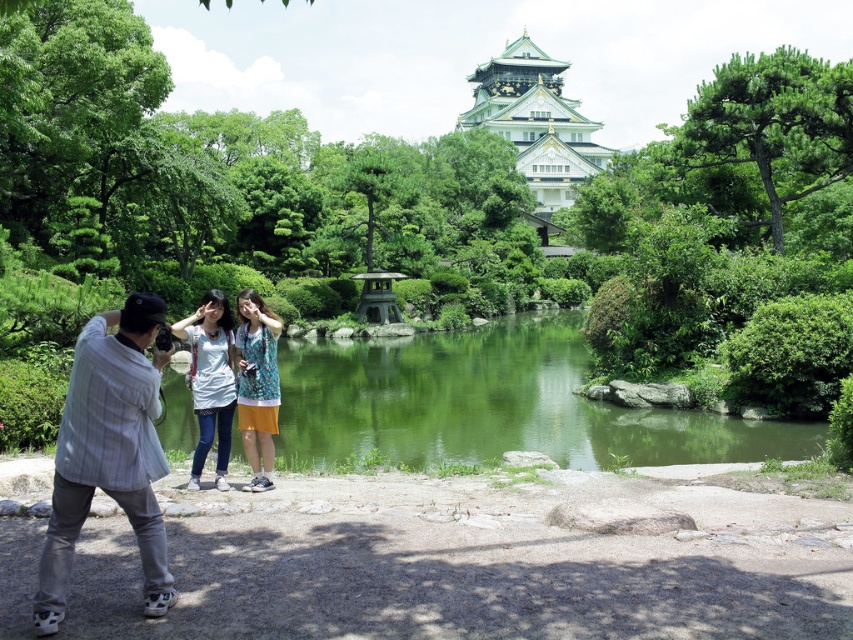
Question: Which point is closer to the camera?

Choices:
 (A) (144, 508)
 (B) (479, 104)
 (C) (213, 349)

Answer: (A)

Question: Is white cotton shirt at center thinner than printed cotton dress at center?

Choices:
 (A) no
 (B) yes

Answer: (A)

Question: Is white cotton shirt at center in front of printed cotton dress at center?

Choices:
 (A) no
 (B) yes

Answer: (B)

Question: Based on their relative distances, which object is nearer to the white cotton shirt at center?

Choices:
 (A) printed cotton dress at center
 (B) white glossy pagoda at upper center

Answer: (A)

Question: Can you confirm if gray striped shirt at left is smaller than printed cotton dress at center?

Choices:
 (A) no
 (B) yes

Answer: (A)

Question: Estimate the real-world distances between objects in this image. Which object is closer to the printed cotton dress at center?

Choices:
 (A) gray striped shirt at left
 (B) white cotton shirt at center
 (C) white glossy pagoda at upper center

Answer: (B)